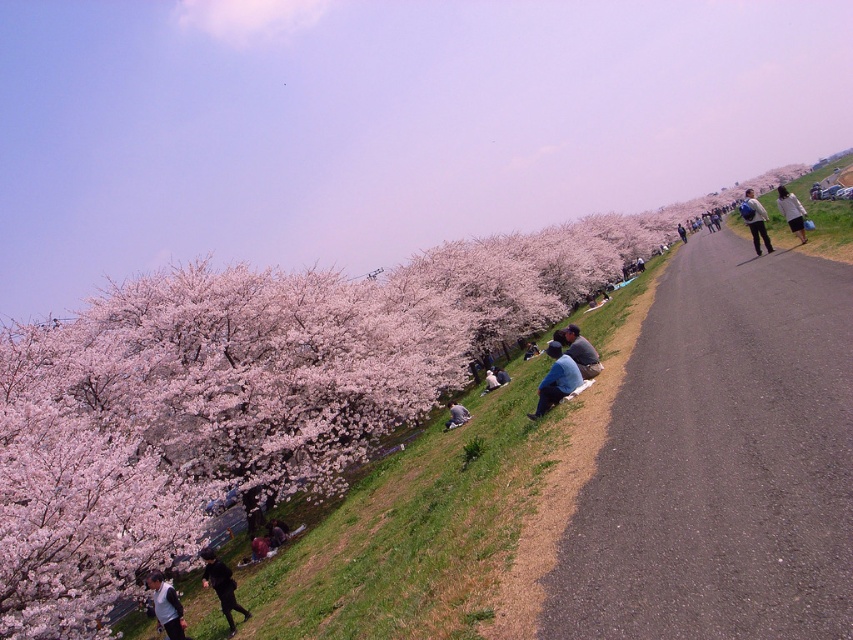
You are standing on the paved pathway and notice two jackets at lower center. Which jacket is closer to the ground, the dark brown leather jacket at lower center or the dark gray fabric jacket at lower center?

The dark brown leather jacket at lower center is located below the dark gray fabric jacket at lower center, so it is closer to the ground.

You are standing on the pathway in the scene and want to walk towards the two points marked in the image. Which point, point (757,205) or point (277,541), will you reach first?

You will reach point (757,205) first because it is closer to you than point (277,541), which is further away.